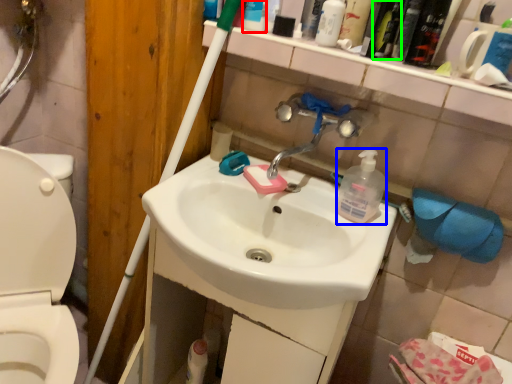
Question: Which is farther away from toiletry (highlighted by a red box)? cleaning product (highlighted by a blue box) or mouthwash (highlighted by a green box)?

Choices:
 (A) cleaning product
 (B) mouthwash

Answer: (A)